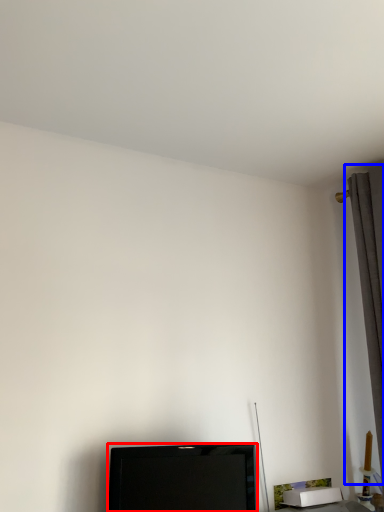
Question: Which object is closer to the camera taking this photo, television (highlighted by a red box) or curtain (highlighted by a blue box)?

Choices:
 (A) television
 (B) curtain

Answer: (A)